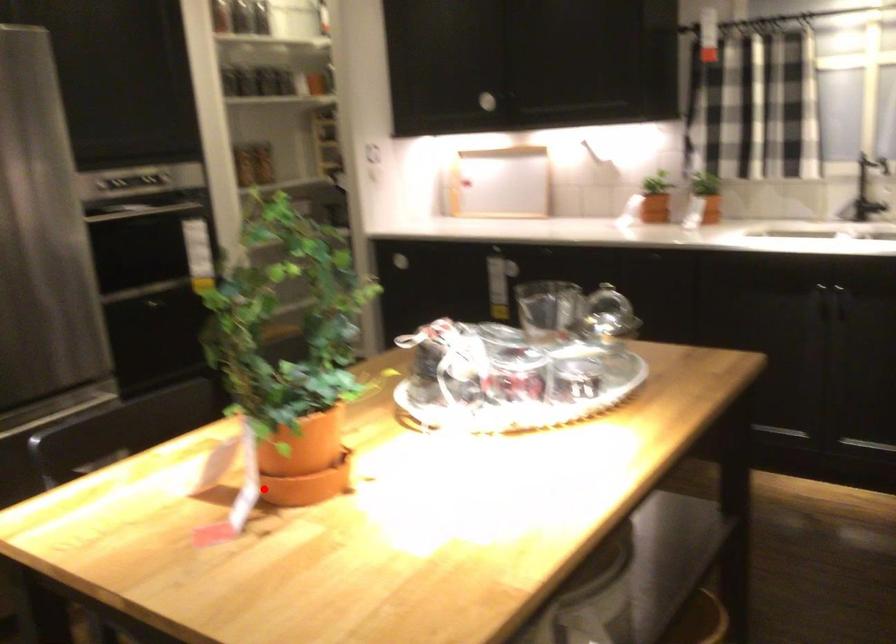
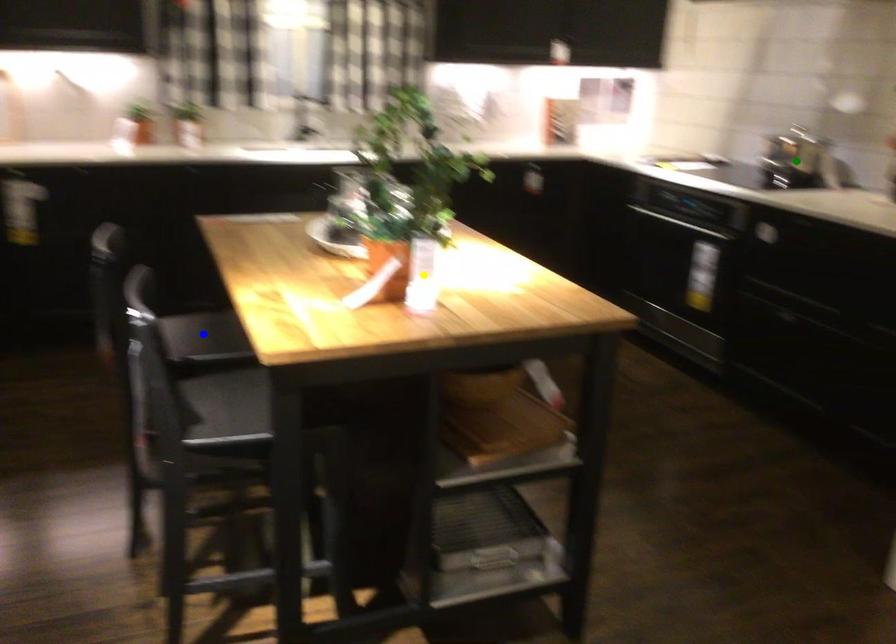
Question: I am providing you with two images of the same scene from different viewpoints. A red point is marked on the first image. You are given multiple points on the second image. Which mark in image 2 goes with the point in image 1?

Choices:
 (A) yellow point
 (B) blue point
 (C) green point

Answer: (A)